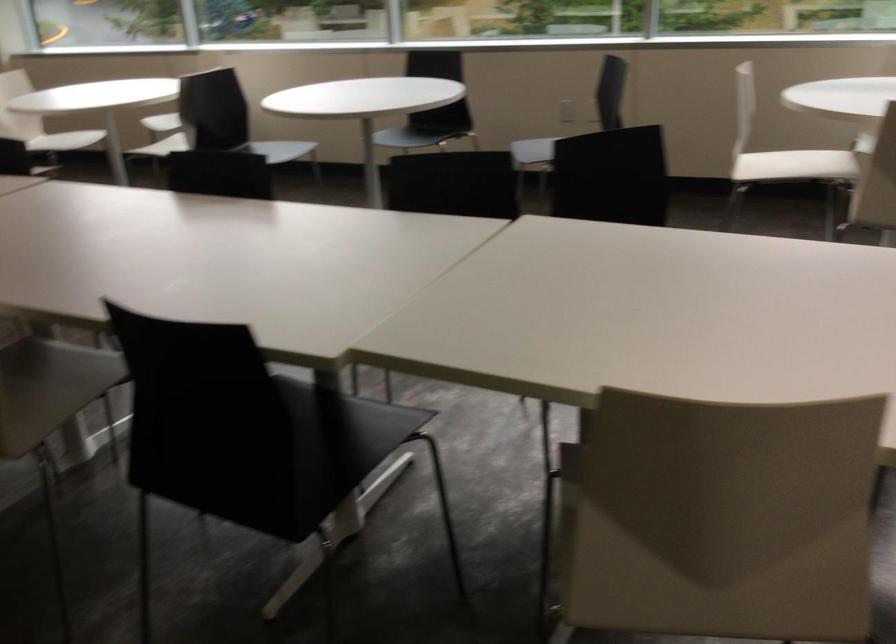
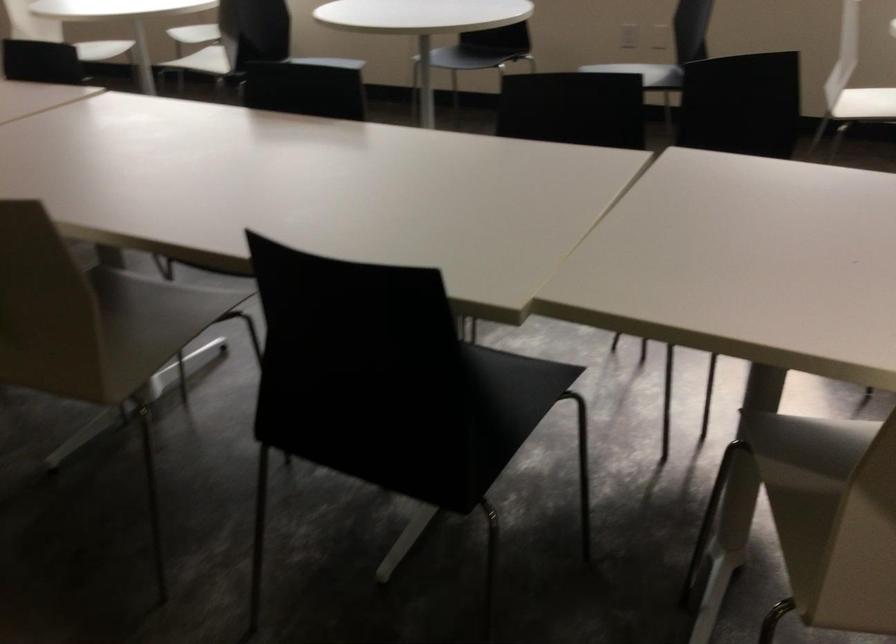
Where in the second image is the point corresponding to (71,377) from the first image?

(159, 317)